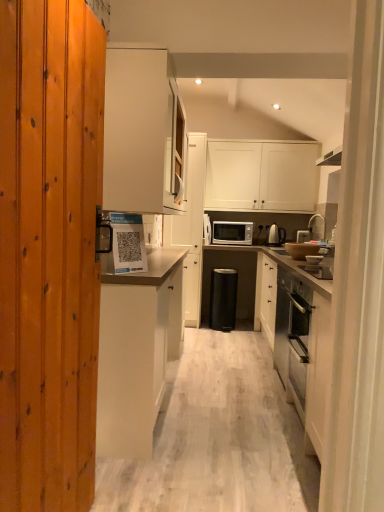
Question: Does silver metallic faucet at upper right come behind white glossy cabinet at upper center, arranged as the 2th cabinetry when viewed from the right?

Choices:
 (A) no
 (B) yes

Answer: (A)

Question: Does silver metallic faucet at upper right have a larger size compared to white glossy cabinet at upper center, arranged as the 2th cabinetry when viewed from the right?

Choices:
 (A) no
 (B) yes

Answer: (A)

Question: Does silver metallic faucet at upper right have a smaller size compared to white glossy cabinet at upper center, which is the 3th cabinetry in left-to-right order?

Choices:
 (A) no
 (B) yes

Answer: (B)

Question: Considering the relative sizes of silver metallic faucet at upper right and white glossy cabinet at upper center, which is the 3th cabinetry in left-to-right order, in the image provided, is silver metallic faucet at upper right taller than white glossy cabinet at upper center, which is the 3th cabinetry in left-to-right order,?

Choices:
 (A) yes
 (B) no

Answer: (B)

Question: Can you confirm if silver metallic faucet at upper right is thinner than white glossy cabinet at upper center, arranged as the 2th cabinetry when viewed from the right?

Choices:
 (A) yes
 (B) no

Answer: (A)

Question: In terms of width, does white matte cabinet at center, marked as the 1th cabinetry in a left-to-right arrangement, look wider or thinner when compared to black plastic trash bin at center?

Choices:
 (A) thin
 (B) wide

Answer: (A)

Question: Does point tap(144, 444) appear closer or farther from the camera than point tap(226, 314)?

Choices:
 (A) farther
 (B) closer

Answer: (B)

Question: Based on their sizes in the image, would you say white matte cabinet at center, marked as the 1th cabinetry in a left-to-right arrangement, is bigger or smaller than black plastic trash bin at center?

Choices:
 (A) big
 (B) small

Answer: (A)

Question: Considering the relative positions of white matte cabinet at center, marked as the 1th cabinetry in a left-to-right arrangement, and black plastic trash bin at center in the image provided, is white matte cabinet at center, marked as the 1th cabinetry in a left-to-right arrangement, to the left or to the right of black plastic trash bin at center?

Choices:
 (A) left
 (B) right

Answer: (A)

Question: Looking at their shapes, would you say white matte cabinet at upper center, the 2th cabinetry positioned from the left, is wider or thinner than satin silver toaster at center?

Choices:
 (A) thin
 (B) wide

Answer: (B)

Question: Do you think white matte cabinet at upper center, acting as the 3th cabinetry starting from the right, is within satin silver toaster at center, or outside of it?

Choices:
 (A) inside
 (B) outside

Answer: (B)

Question: Considering the positions of white matte cabinet at upper center, acting as the 3th cabinetry starting from the right, and satin silver toaster at center in the image, is white matte cabinet at upper center, acting as the 3th cabinetry starting from the right, bigger or smaller than satin silver toaster at center?

Choices:
 (A) small
 (B) big

Answer: (B)

Question: Visually, is white matte cabinet at upper center, the 2th cabinetry positioned from the left, positioned to the left or to the right of satin silver toaster at center?

Choices:
 (A) left
 (B) right

Answer: (A)

Question: From the image's perspective, is satin silver toaster at center located above or below black plastic trash bin at center?

Choices:
 (A) below
 (B) above

Answer: (B)

Question: Considering the positions of point (306, 229) and point (210, 298), is point (306, 229) closer or farther from the camera than point (210, 298)?

Choices:
 (A) farther
 (B) closer

Answer: (A)